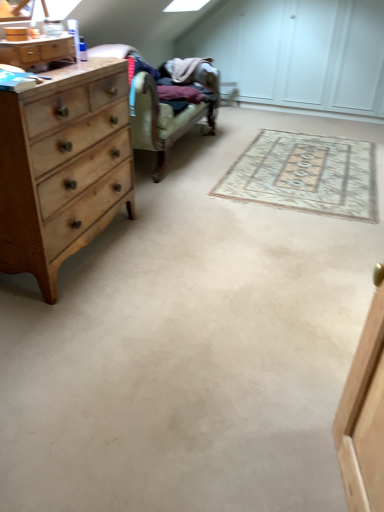
Question: Is beige woven rug at center looking in the opposite direction of wooden dresser at left?

Choices:
 (A) no
 (B) yes

Answer: (A)

Question: Is beige woven rug at center completely or partially outside of wooden dresser at left?

Choices:
 (A) no
 (B) yes

Answer: (B)

Question: Considering the relative sizes of beige woven rug at center and wooden dresser at left in the image provided, is beige woven rug at center thinner than wooden dresser at left?

Choices:
 (A) yes
 (B) no

Answer: (B)

Question: From the image's perspective, is beige woven rug at center located above wooden dresser at left?

Choices:
 (A) yes
 (B) no

Answer: (B)

Question: Does beige woven rug at center turn towards wooden dresser at left?

Choices:
 (A) no
 (B) yes

Answer: (A)

Question: From a real-world perspective, relative to wooden dresser at left, is beige woven rug at center vertically above or below?

Choices:
 (A) above
 (B) below

Answer: (B)

Question: In the image, is beige woven rug at center positioned in front of or behind wooden dresser at left?

Choices:
 (A) front
 (B) behind

Answer: (B)

Question: Which is correct: beige woven rug at center is inside wooden dresser at left, or outside of it?

Choices:
 (A) outside
 (B) inside

Answer: (A)

Question: From the image's perspective, relative to wooden dresser at left, is beige woven rug at center above or below?

Choices:
 (A) below
 (B) above

Answer: (A)

Question: Considering the positions of wooden dresser at left and light brown wood chest of drawers at left in the image, is wooden dresser at left wider or thinner than light brown wood chest of drawers at left?

Choices:
 (A) wide
 (B) thin

Answer: (B)

Question: Is wooden dresser at left to the left or to the right of light brown wood chest of drawers at left in the image?

Choices:
 (A) left
 (B) right

Answer: (B)

Question: In terms of size, does wooden dresser at left appear bigger or smaller than light brown wood chest of drawers at left?

Choices:
 (A) small
 (B) big

Answer: (A)

Question: Choose the correct answer: Is wooden dresser at left inside light brown wood chest of drawers at left or outside it?

Choices:
 (A) outside
 (B) inside

Answer: (A)

Question: Which is correct: light brown wood chest of drawers at left is inside wooden dresser at left, or outside of it?

Choices:
 (A) outside
 (B) inside

Answer: (A)

Question: Looking at the image, does light brown wood chest of drawers at left seem bigger or smaller compared to wooden dresser at left?

Choices:
 (A) small
 (B) big

Answer: (B)